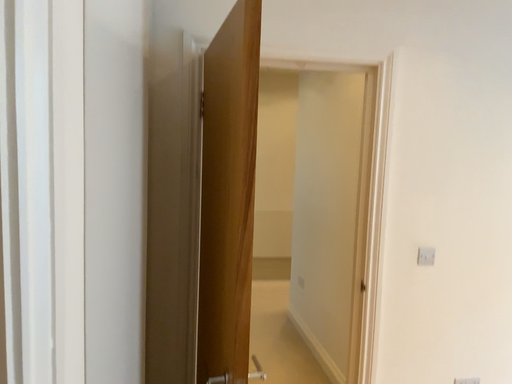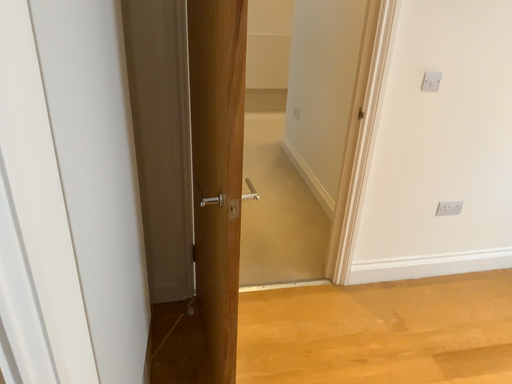
Question: How did the camera likely rotate when shooting the video?

Choices:
 (A) rotated upward
 (B) rotated downward

Answer: (B)